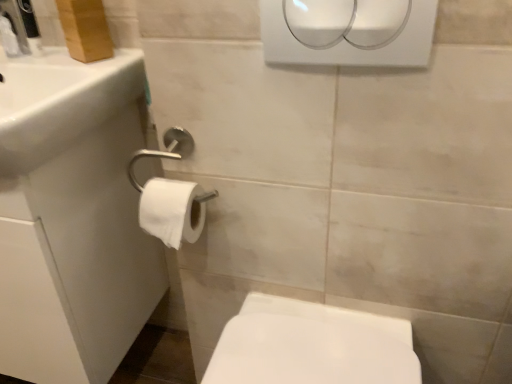
You are a GUI agent. You are given a task and a screenshot of the screen. Output one action in this format:
    pyautogui.click(x=<x>, y=<y>)
    Task: Click on the white glossy bidet at lower right
    The height and width of the screenshot is (384, 512).
    Given the screenshot: What is the action you would take?
    pyautogui.click(x=313, y=350)

This screenshot has height=384, width=512. What are the coordinates of `white glossy sink at upper left` in the screenshot? It's located at (60, 102).

The image size is (512, 384). What do you see at coordinates (172, 210) in the screenshot?
I see `white matte toilet paper at lower left` at bounding box center [172, 210].

Identify the location of white glossy bidet at lower right. (313, 350).

Can you confirm if white glossy sink at upper left is shorter than white glossy bidet at lower right?

Yes, white glossy sink at upper left is shorter than white glossy bidet at lower right.

Is white glossy sink at upper left wider or thinner than white glossy bidet at lower right?

white glossy sink at upper left is wider than white glossy bidet at lower right.

Can we say white glossy sink at upper left lies outside white glossy bidet at lower right?

Yes, white glossy sink at upper left is located beyond the bounds of white glossy bidet at lower right.

Is white glossy sink at upper left in front of or behind white glossy bidet at lower right in the image?

Visually, white glossy sink at upper left is located in front of white glossy bidet at lower right.

Is the surface of white glossy sink at left in direct contact with white plastic hand dryer at upper center?

There is a gap between white glossy sink at left and white plastic hand dryer at upper center.

Does white glossy sink at left have a smaller size compared to white plastic hand dryer at upper center?

No.

Is white glossy sink at left facing towards white plastic hand dryer at upper center?

No, white glossy sink at left is not facing towards white plastic hand dryer at upper center.

Can we say white glossy sink at left lies outside white plastic hand dryer at upper center?

That's correct, white glossy sink at left is outside of white plastic hand dryer at upper center.

From a real-world perspective, which is physically below, white glossy sink at left or white glossy bidet at lower right?

From a 3D spatial view, white glossy bidet at lower right is below.

Locate an element on the screen. Image resolution: width=512 pixels, height=384 pixels. bidet in front of the white glossy sink at left is located at coordinates (313, 350).

Which of these two, white glossy sink at left or white glossy bidet at lower right, is smaller?

white glossy bidet at lower right.

Is white glossy sink at left taller than white glossy bidet at lower right?

Indeed, white glossy sink at left has a greater height compared to white glossy bidet at lower right.

Who is taller, white glossy bidet at lower right or white glossy sink at left?

white glossy sink at left.

Considering the relative sizes of white glossy bidet at lower right and white glossy sink at left in the image provided, is white glossy bidet at lower right smaller than white glossy sink at left?

Yes, white glossy bidet at lower right is smaller than white glossy sink at left.

Considering the relative positions of white glossy bidet at lower right and white glossy sink at left in the image provided, is white glossy bidet at lower right to the left of white glossy sink at left from the viewer's perspective?

In fact, white glossy bidet at lower right is to the right of white glossy sink at left.

Is white glossy sink at left in front of or behind white matte toilet paper at lower left in the image?

Clearly, white glossy sink at left is in front of white matte toilet paper at lower left.

From a real-world perspective, between white glossy sink at left and white matte toilet paper at lower left, who is vertically lower?

white glossy sink at left is physically lower.

Is white glossy sink at left situated inside white matte toilet paper at lower left or outside?

white glossy sink at left is located beyond the bounds of white matte toilet paper at lower left.

Is white glossy bidet at lower right positioned with its back to white glossy sink at upper left?

No, white glossy sink at upper left is not at the back of white glossy bidet at lower right.

Can you confirm if white glossy bidet at lower right is shorter than white glossy sink at upper left?

No.

Are white glossy bidet at lower right and white glossy sink at upper left making contact?

No, white glossy bidet at lower right is not in contact with white glossy sink at upper left.

Who is shorter, white glossy bidet at lower right or white plastic hand dryer at upper center?

Standing shorter between the two is white plastic hand dryer at upper center.

Is white glossy bidet at lower right situated inside white plastic hand dryer at upper center or outside?

white glossy bidet at lower right is located beyond the bounds of white plastic hand dryer at upper center.

From the picture: From the image's perspective, is white glossy bidet at lower right located above white plastic hand dryer at upper center?

No, from the image's perspective, white glossy bidet at lower right is not on top of white plastic hand dryer at upper center.

How different are the orientations of white glossy bidet at lower right and white plastic hand dryer at upper center in degrees?

The angle between the facing direction of white glossy bidet at lower right and the facing direction of white plastic hand dryer at upper center is 0.00132 degrees.

Where is `sink that appears above the white glossy bidet at lower right (from the image's perspective)`? Image resolution: width=512 pixels, height=384 pixels. sink that appears above the white glossy bidet at lower right (from the image's perspective) is located at coordinates (60, 102).

At what (x,y) coordinates should I click in order to perform the action: click on hand dryer in front of the white glossy sink at left. Please return your answer as a coordinate pair (x, y). This screenshot has height=384, width=512. Looking at the image, I should click on (349, 44).

Which object lies nearer to the anchor point white matte toilet paper at lower left, white glossy sink at upper left or white glossy bidet at lower right?

Based on the image, white glossy sink at upper left appears to be nearer to white matte toilet paper at lower left.

Which object lies nearer to the anchor point white glossy bidet at lower right, white matte toilet paper at lower left or white glossy sink at left?

The object closer to white glossy bidet at lower right is white matte toilet paper at lower left.

Considering their positions, is white matte toilet paper at lower left positioned closer to white glossy bidet at lower right than white glossy sink at upper left?

Among the two, white matte toilet paper at lower left is located nearer to white glossy bidet at lower right.

Which object lies nearer to the anchor point white matte toilet paper at lower left, white glossy sink at upper left or white plastic hand dryer at upper center?

white glossy sink at upper left is positioned closer to the anchor white matte toilet paper at lower left.

From the image, which object appears to be nearer to white glossy sink at upper left, white plastic hand dryer at upper center or white matte toilet paper at lower left?

white matte toilet paper at lower left.

Considering their positions, is white glossy sink at upper left positioned closer to white plastic hand dryer at upper center than white glossy sink at left?

Among the two, white glossy sink at upper left is located nearer to white plastic hand dryer at upper center.

Which object lies nearer to the anchor point white glossy bidet at lower right, white glossy sink at upper left or white glossy sink at left?

white glossy sink at left is closer to white glossy bidet at lower right.

Estimate the real-world distances between objects in this image. Which object is closer to white glossy sink at left, white matte toilet paper at lower left or white glossy bidet at lower right?

white matte toilet paper at lower left is closer to white glossy sink at left.

This screenshot has width=512, height=384. Find the location of `sink between white glossy sink at left and white glossy bidet at lower right in the horizontal direction`. sink between white glossy sink at left and white glossy bidet at lower right in the horizontal direction is located at coordinates (60, 102).

This screenshot has height=384, width=512. I want to click on sink between white glossy sink at left and white plastic hand dryer at upper center from left to right, so click(60, 102).

The image size is (512, 384). Find the location of `sink between white glossy sink at left and white matte toilet paper at lower left from left to right`. sink between white glossy sink at left and white matte toilet paper at lower left from left to right is located at coordinates (60, 102).

The image size is (512, 384). Find the location of `toilet paper located between white glossy sink at upper left and white plastic hand dryer at upper center in the left-right direction`. toilet paper located between white glossy sink at upper left and white plastic hand dryer at upper center in the left-right direction is located at coordinates (172, 210).